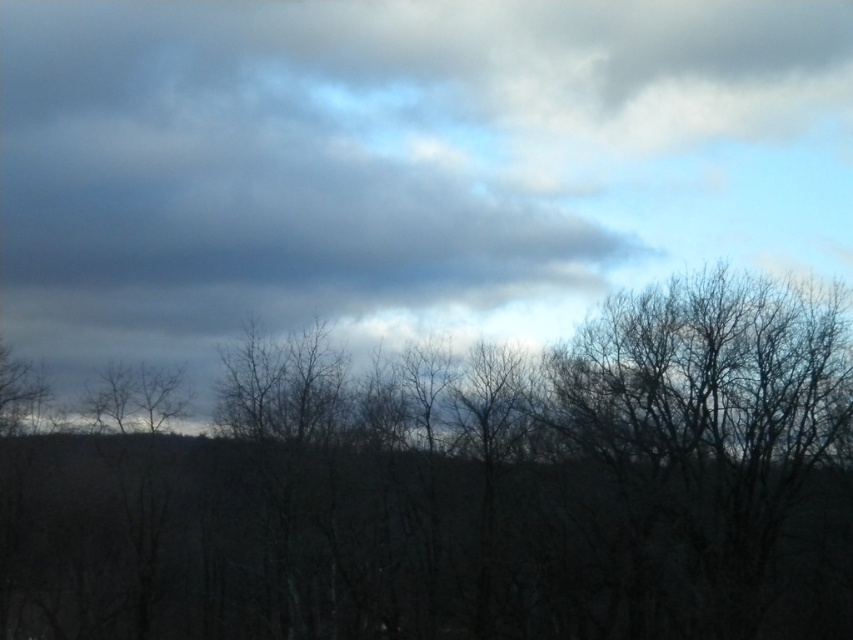
Is cloudy sky at upper center further to camera compared to brown/rough tree at center?

That is True.

From the picture: Can you confirm if cloudy sky at upper center is shorter than brown/rough tree at center?

Incorrect, cloudy sky at upper center's height does not fall short of brown/rough tree at center's.

Is point (7, 99) positioned behind point (74, 436)?

Yes, it is behind point (74, 436).

Locate an element on the screen. The height and width of the screenshot is (640, 853). cloudy sky at upper center is located at coordinates (399, 164).